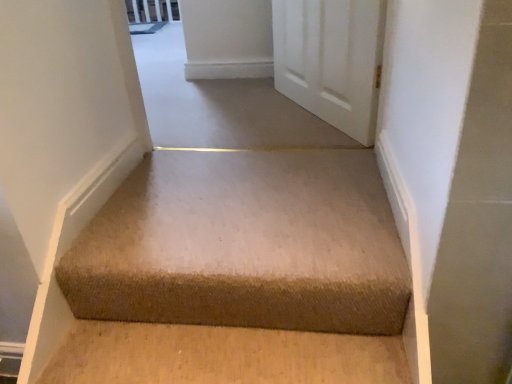
Question: Is beige carpet at upper center bigger or smaller than beige carpet at center?

Choices:
 (A) small
 (B) big

Answer: (B)

Question: Relative to beige carpet at center, is beige carpet at upper center in front or behind?

Choices:
 (A) front
 (B) behind

Answer: (B)

Question: From the image's perspective, is beige carpet at upper center above or below beige carpet at center?

Choices:
 (A) below
 (B) above

Answer: (B)

Question: In terms of width, does beige carpet at center look wider or thinner when compared to beige carpet at upper center?

Choices:
 (A) thin
 (B) wide

Answer: (A)

Question: Considering the positions of point (275, 304) and point (302, 16), is point (275, 304) closer or farther from the camera than point (302, 16)?

Choices:
 (A) farther
 (B) closer

Answer: (B)

Question: In terms of height, does beige carpet at center look taller or shorter compared to beige carpet at upper center?

Choices:
 (A) tall
 (B) short

Answer: (B)

Question: Considering their positions, is beige carpet at center located in front of or behind beige carpet at upper center?

Choices:
 (A) behind
 (B) front

Answer: (B)